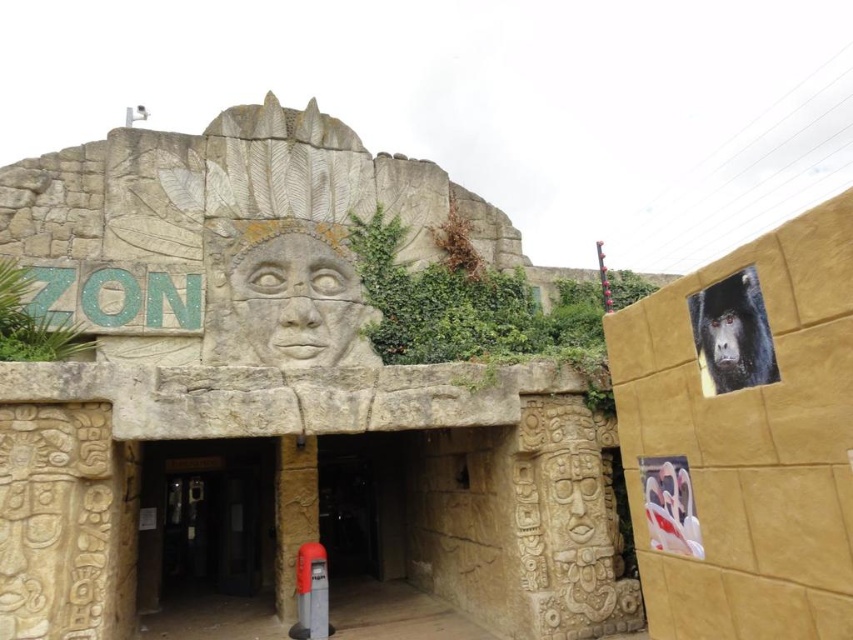
Looking at this image, you are standing at the entrance of the themed area and want to take a photo of the rough stone face at center. According to the coordinates provided, where should you position yourself to capture the stone face in the center of your camera frame?

The rough stone face at center is located at point coordinates (x=297, y=301), so positioning yourself directly in front of these coordinates will ensure the stone face is centered in your photo.

You are standing in front of the entrance to the themed area. There is a point marked at coordinates (206, 518). What does this point indicate?

The point at coordinates (206, 518) marks the dark brown stone entrance at center.